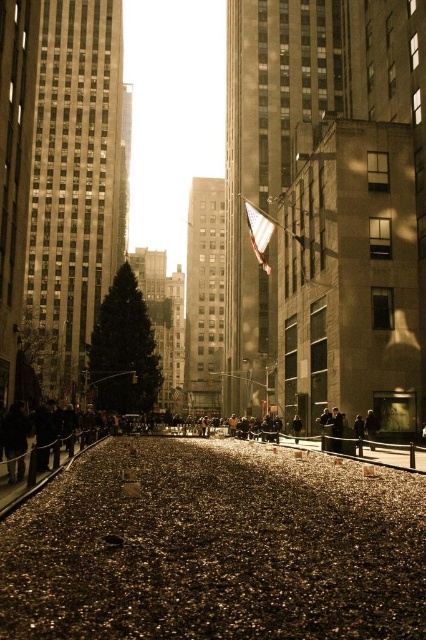
You are standing in the city plaza and see both the dark brown leather jacket at center and the dark brown leather coat at center. Which one is positioned more to the right side?

The dark brown leather jacket at center is positioned more to the right side than the dark brown leather coat at center.

You are a street performer in the plaza and want to place your hat on the ground between the dark brown leather jacket at center and the dark gray jacket at center. Can you do that?

The dark brown leather jacket at center is located above the dark gray jacket at center, so there is space between them on the ground where you can place your hat.